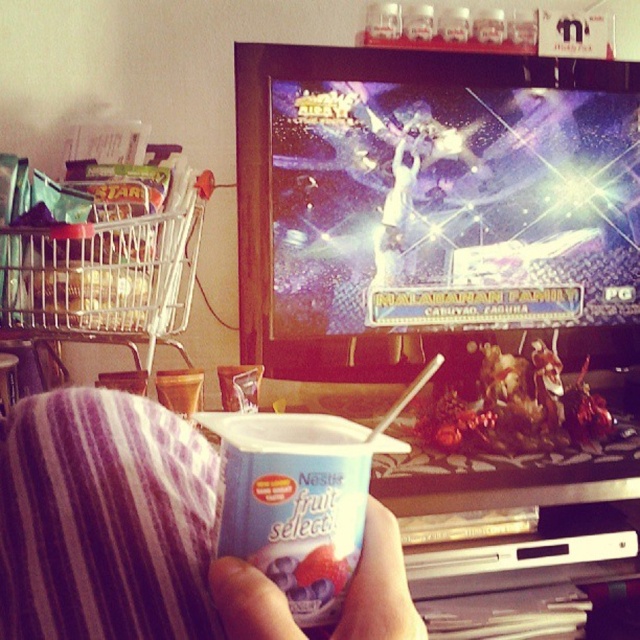
Question: Where is purple striped fabric at lower left located in relation to metallic wire shopping cart at left in the image?

Choices:
 (A) right
 (B) left

Answer: (A)

Question: Which of the following is the closest to the observer?

Choices:
 (A) metallic wire shopping cart at left
 (B) purple striped fabric at lower left

Answer: (B)

Question: Which point is closer to the camera?

Choices:
 (A) white matte cup at lower center
 (B) metallic wire shopping cart at left

Answer: (A)

Question: Is purple striped fabric at lower left positioned at the back of metallic wire shopping cart at left?

Choices:
 (A) yes
 (B) no

Answer: (B)

Question: Estimate the real-world distances between objects in this image. Which object is farther from the purple striped fabric at lower left?

Choices:
 (A) white matte cup at lower center
 (B) metallic wire shopping cart at left

Answer: (B)

Question: Is purple striped fabric at lower left below white matte cup at lower center?

Choices:
 (A) no
 (B) yes

Answer: (A)